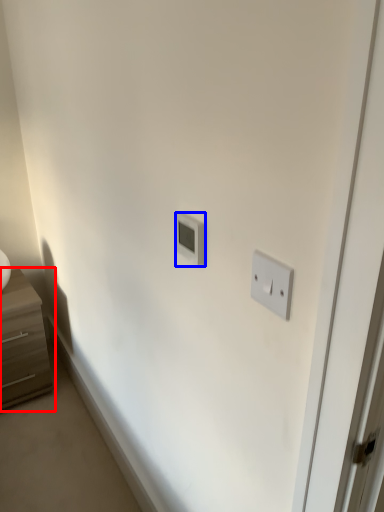
Question: Which object is closer to the camera taking this photo, chest of drawers (highlighted by a red box) or light switch (highlighted by a blue box)?

Choices:
 (A) chest of drawers
 (B) light switch

Answer: (B)